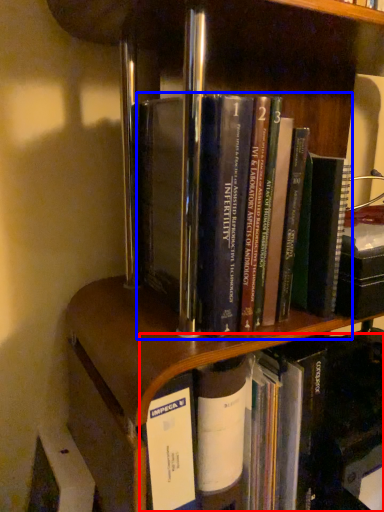
Question: Which object appears farthest to the camera in this image, book (highlighted by a red box) or book (highlighted by a blue box)?

Choices:
 (A) book
 (B) book

Answer: (A)